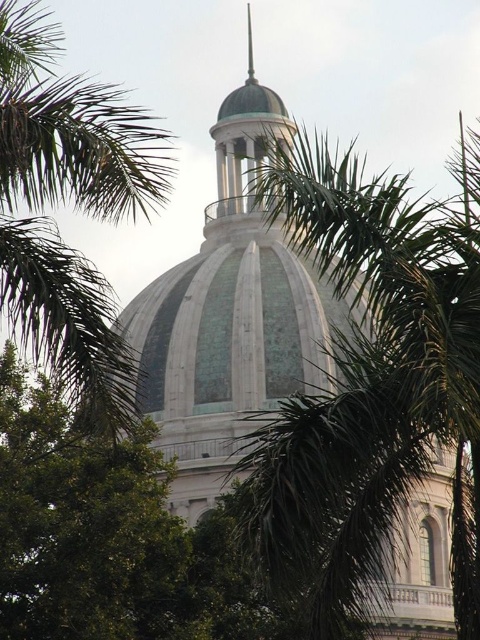
Question: Can you confirm if green leafy palm tree at center is wider than green leafy palm tree at upper center?

Choices:
 (A) yes
 (B) no

Answer: (A)

Question: Is green leafy palm tree at center wider than green leafy palm tree at upper center?

Choices:
 (A) no
 (B) yes

Answer: (B)

Question: Which point appears farthest from the camera in this image?

Choices:
 (A) (x=347, y=259)
 (B) (x=63, y=317)

Answer: (A)

Question: Does green leafy palm tree at center have a larger size compared to green leafy palm tree at upper center?

Choices:
 (A) yes
 (B) no

Answer: (A)

Question: Which object appears farthest from the camera in this image?

Choices:
 (A) green leafy palm tree at center
 (B) green leafy palm tree at upper center

Answer: (B)